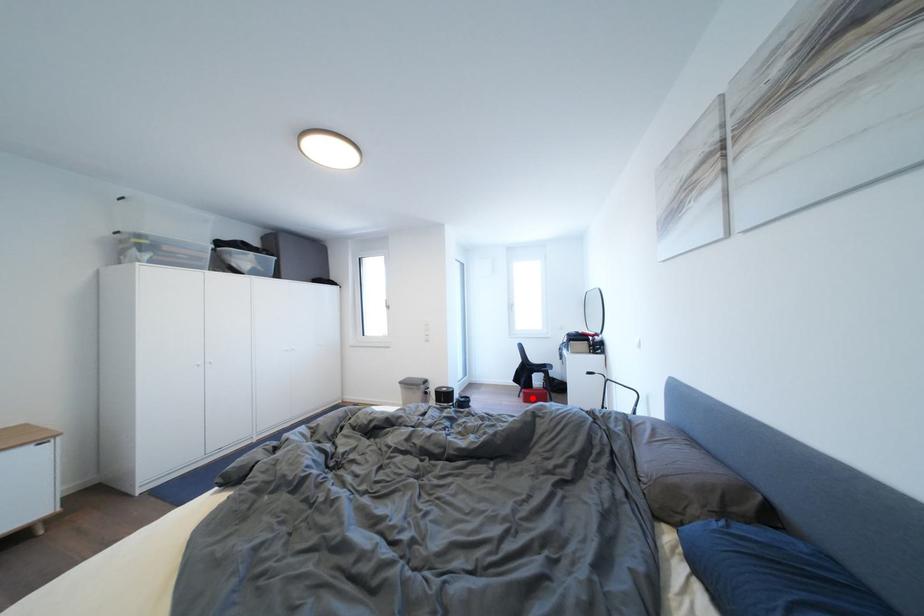
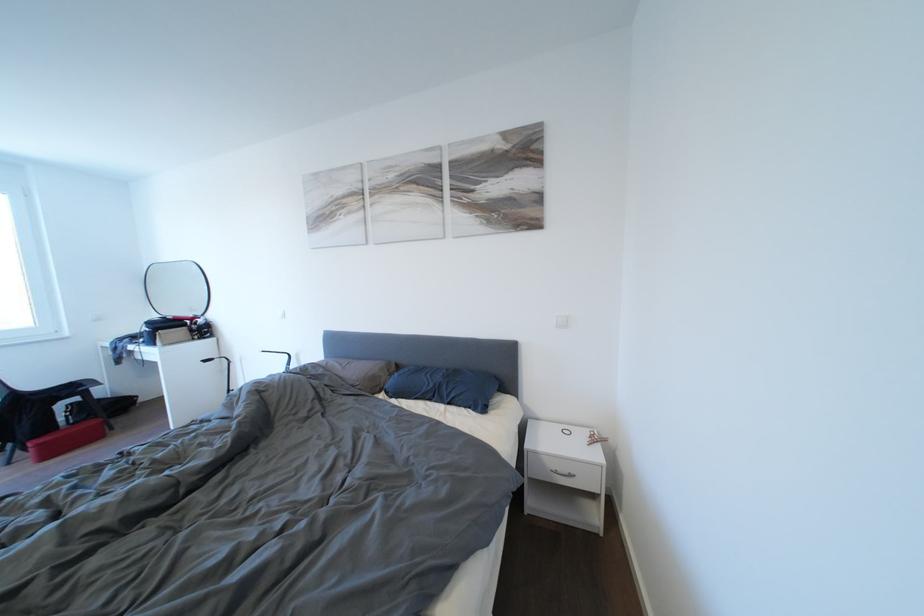
Question: I am providing you with two images of the same scene from different viewpoints. Image1 has a red point marked. In image2, the corresponding 3D location appears at what relative position? Reply with the corresponding letter.

Choices:
 (A) Closer
 (B) Farther

Answer: (A)